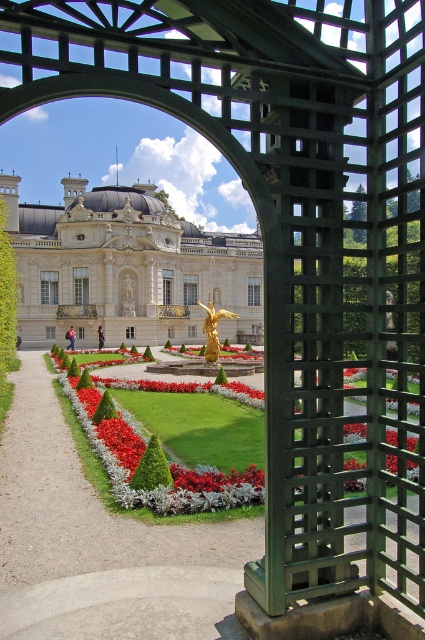
Who is taller, gravel pathway at center or white glossy palace at center?

white glossy palace at center

Which is more to the left, gravel pathway at center or white glossy palace at center?

From the viewer's perspective, white glossy palace at center appears more on the left side.

Who is more distant from viewer, (130, 625) or (36, 204)?

The point (36, 204) is more distant.

Locate an element on the screen. gravel pathway at center is located at coordinates (101, 545).

Who is lower down, gravel pathway at center or gold polished statue at center?

Positioned lower is gravel pathway at center.

Is the position of gravel pathway at center less distant than that of gold polished statue at center?

Yes, it is in front of gold polished statue at center.

Identify the location of gravel pathway at center. (101, 545).

This screenshot has height=640, width=425. Identify the location of gravel pathway at center. (101, 545).

This screenshot has width=425, height=640. What do you see at coordinates (127, 266) in the screenshot? I see `white glossy palace at center` at bounding box center [127, 266].

Which is above, white glossy palace at center or gold polished statue at center?

white glossy palace at center is higher up.

Does point (62, 317) come closer to viewer compared to point (215, 349)?

No, it is not.

This screenshot has height=640, width=425. What are the coordinates of `white glossy palace at center` in the screenshot? It's located at (127, 266).